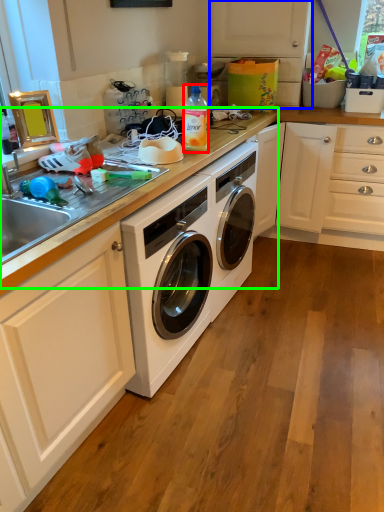
Question: Considering the real-world distances, which object is farthest from bottle (highlighted by a red box)? cabinetry (highlighted by a blue box) or counter top (highlighted by a green box)?

Choices:
 (A) cabinetry
 (B) counter top

Answer: (A)